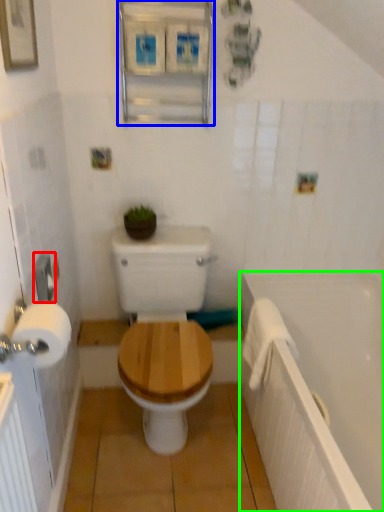
Question: Which object is the farthest from towel bar (highlighted by a red box)? Choose among these: medicine cabinet (highlighted by a blue box) or bath (highlighted by a green box).

Choices:
 (A) medicine cabinet
 (B) bath

Answer: (B)